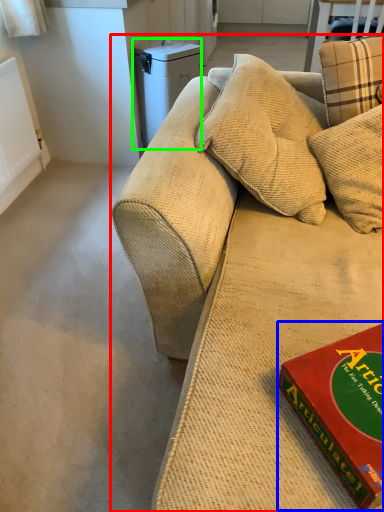
Question: Considering the real-world distances, which object is farthest from studio couch (highlighted by a red box)? paperback book (highlighted by a blue box) or appliance (highlighted by a green box)?

Choices:
 (A) paperback book
 (B) appliance

Answer: (B)